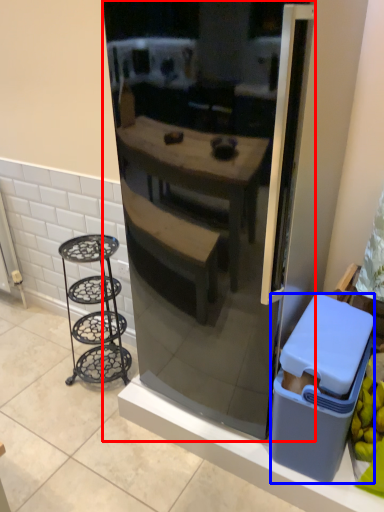
Question: Which object appears closest to the camera in this image, refrigerator (highlighted by a red box) or trash bin/can (highlighted by a blue box)?

Choices:
 (A) refrigerator
 (B) trash bin/can

Answer: (A)